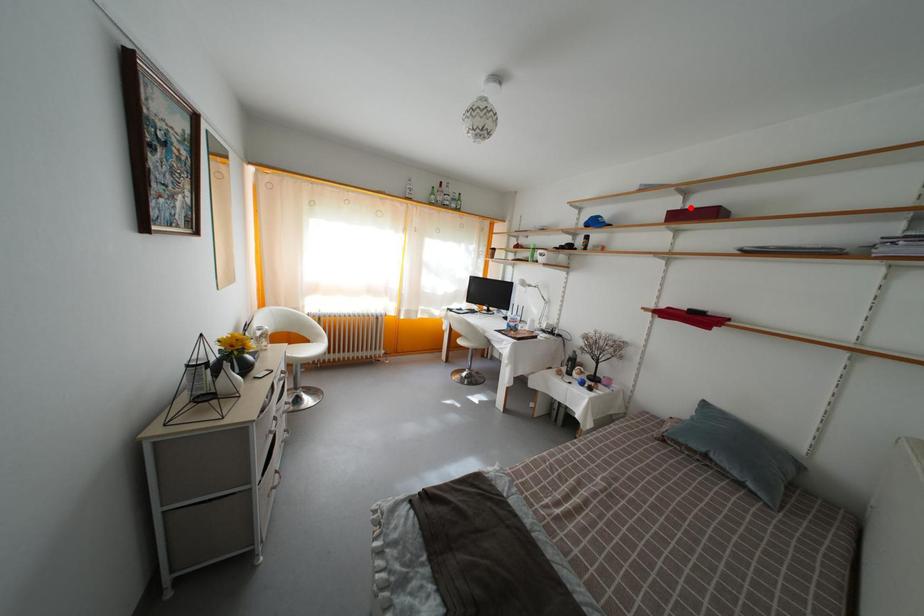
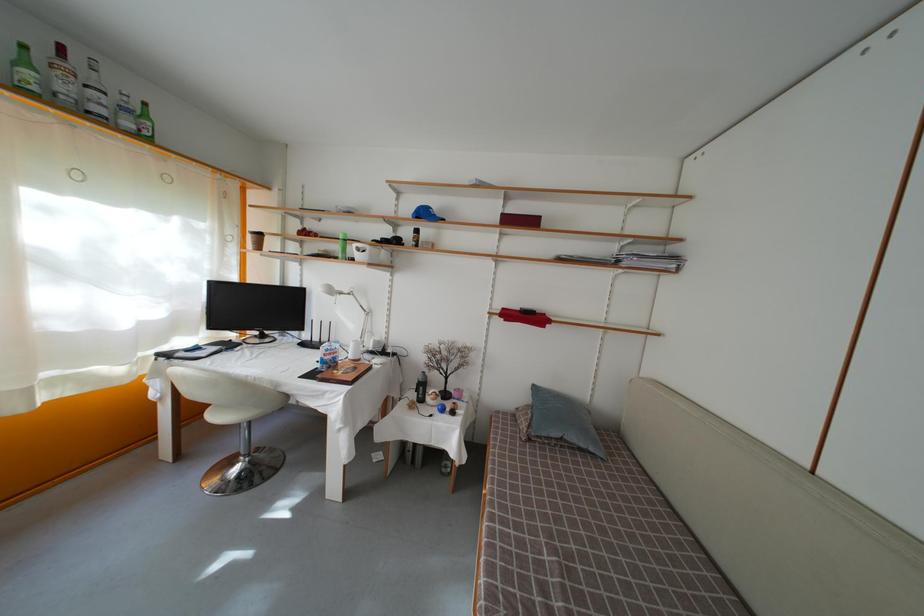
Locate, in the second image, the point that corresponds to the highlighted location in the first image.

(509, 213)